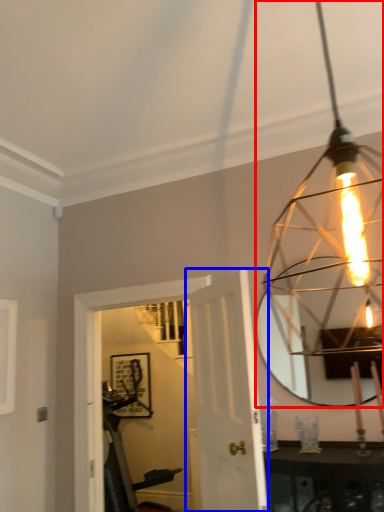
Question: Among these objects, which one is nearest to the camera, lamp (highlighted by a red box) or door (highlighted by a blue box)?

Choices:
 (A) lamp
 (B) door

Answer: (A)